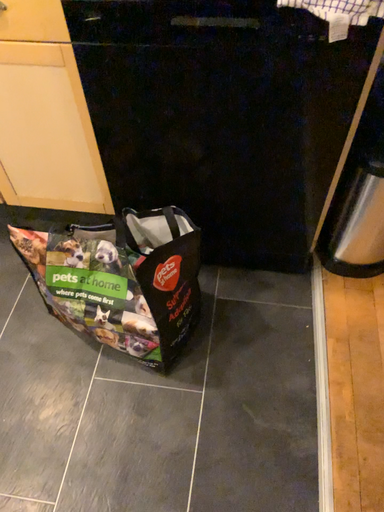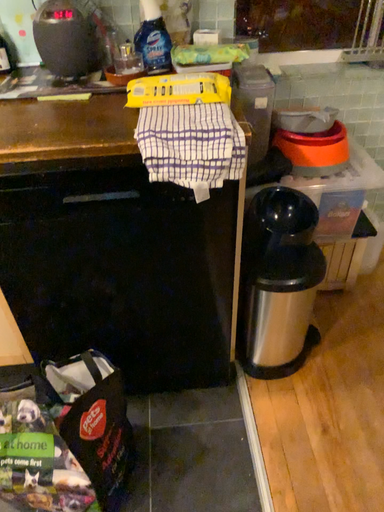
Question: Which way did the camera rotate in the video?

Choices:
 (A) rotated left
 (B) rotated right

Answer: (B)